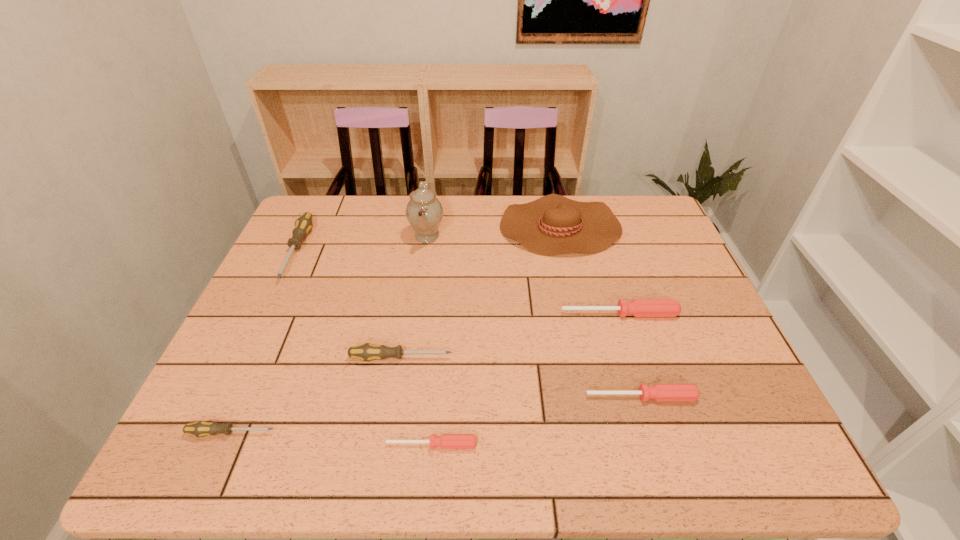
Where is `chinaware`? The height and width of the screenshot is (540, 960). chinaware is located at coordinates (424, 212).

Image resolution: width=960 pixels, height=540 pixels. In order to click on the seventh shortest object in this screenshot , I will do `click(553, 224)`.

I want to click on the biggest gray screwdriver, so click(x=303, y=225).

Where is `the tallest screwdriver`? the tallest screwdriver is located at coordinates (303, 225).

Locate an element on the screen. The image size is (960, 540). the second farthest gray screwdriver is located at coordinates (366, 352).

Image resolution: width=960 pixels, height=540 pixels. Find the location of `the second biggest gray screwdriver`. the second biggest gray screwdriver is located at coordinates (366, 352).

This screenshot has width=960, height=540. In order to click on the farthest red screwdriver in this screenshot , I will do `click(638, 307)`.

Where is `the fifth nearest object`? The height and width of the screenshot is (540, 960). the fifth nearest object is located at coordinates (638, 307).

Identify the location of the third nearest object. The width and height of the screenshot is (960, 540). (659, 392).

I want to click on the fourth farthest screwdriver, so click(659, 392).